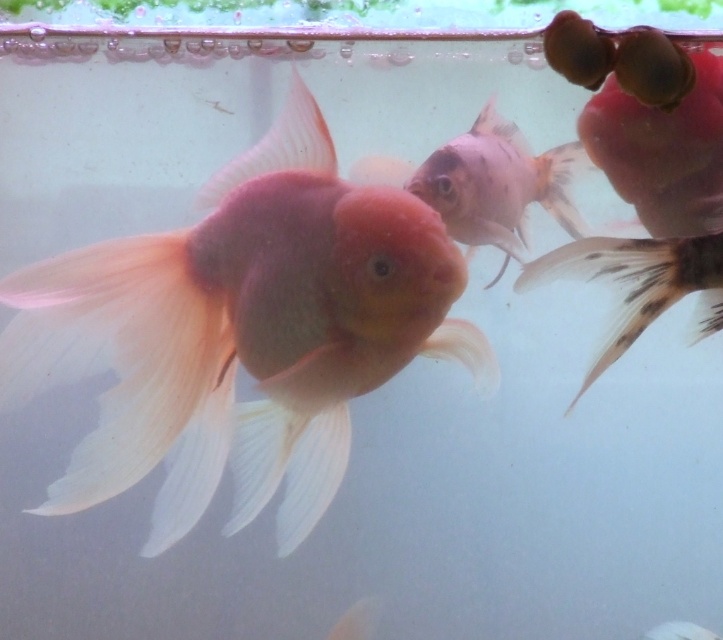
You are a new goldfish in the tank and want to swim to the black spotted tail fin at right. Which direction should you go from the translucent pink fish at center?

The translucent pink fish at center is thinner than the black spotted tail fin at right, so you should swim to the right side of the tank to reach the black spotted tail fin at right.

You are a robotic fish cleaner in the tank. Your current position is at point 0.5, 0.3. You need to move to the matte pink goldfish at center. What direction should you move in to reach it?

The matte pink goldfish at center is located at point (241, 332). Since your current position is at (215, 320), you should move northeast to reach it.